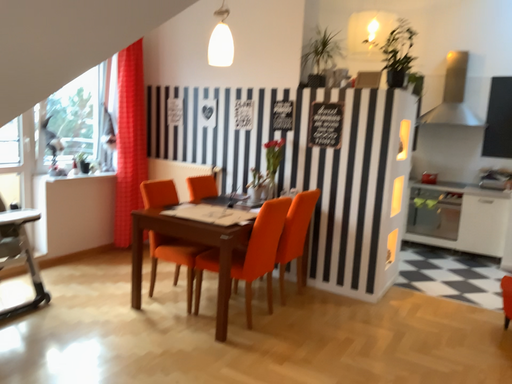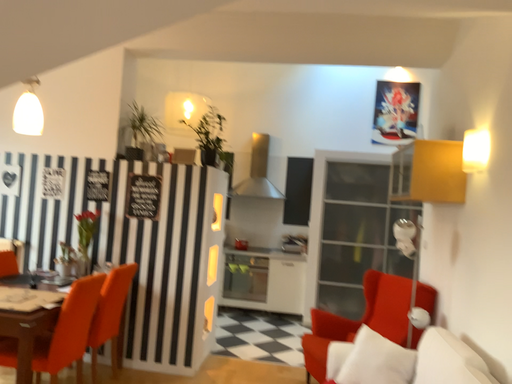
Question: Which way did the camera rotate in the video?

Choices:
 (A) rotated right
 (B) rotated left

Answer: (A)